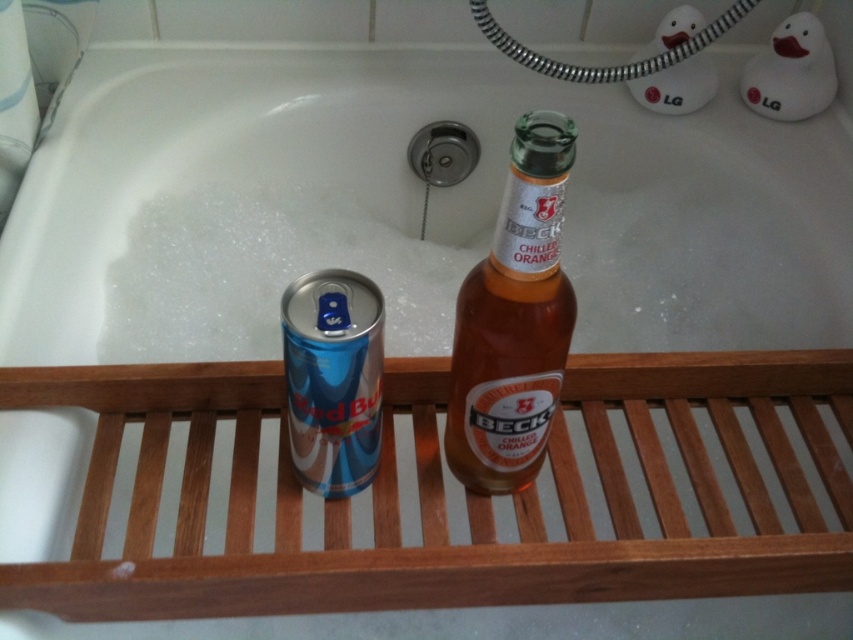
You are a photographer taking a picture of the bathroom scene. You need to focus on the two points in the image labeled as point (370,268) and point (535,474). Which point should you focus on first to ensure the nearest object is sharp?

You should focus on point (370,268) first because it is closer to the camera than point (535,474), ensuring the nearest object is in sharp focus.

You are a delivery person who just arrived at the bathroom and need to place a new bottle of shampoo next to the translucent amber glass bottle at center. Considering the size of the white glossy bathtub at upper center, will there be enough space on the wooden shelf to place the new bottle?

The white glossy bathtub at upper center is bigger than the translucent amber glass bottle at center, but the size of the bathtub does not directly indicate the available space on the wooden shelf. You need to check the shelf size separately.

You are a delivery person who just arrived at the house. You need to place a new bathtub in the bathroom, but you must ensure it doesn not block the existing white glossy bathtub at upper center. What is the minimum distance you should keep between the new bathtub and the existing one?

The existing white glossy bathtub at upper center is 63.27 centimeters away from the viewer. To avoid blocking it, the new bathtub should be placed at least 63.27 centimeters away from the existing one.